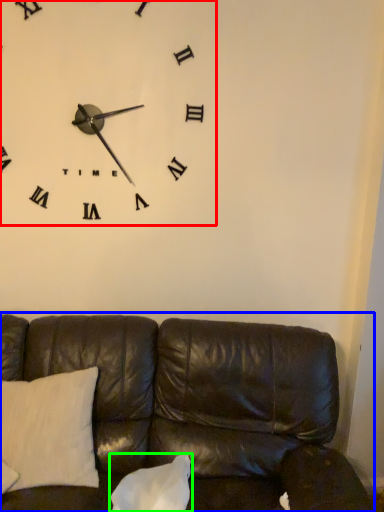
Question: Considering the real-world distances, which object is farthest from wall clock (highlighted by a red box)? studio couch (highlighted by a blue box) or pillow (highlighted by a green box)?

Choices:
 (A) studio couch
 (B) pillow

Answer: (B)